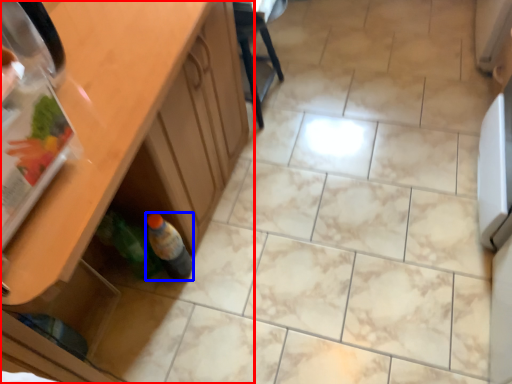
Question: Which object is further to the camera taking this photo, cabinetry (highlighted by a red box) or bottle (highlighted by a blue box)?

Choices:
 (A) cabinetry
 (B) bottle

Answer: (B)